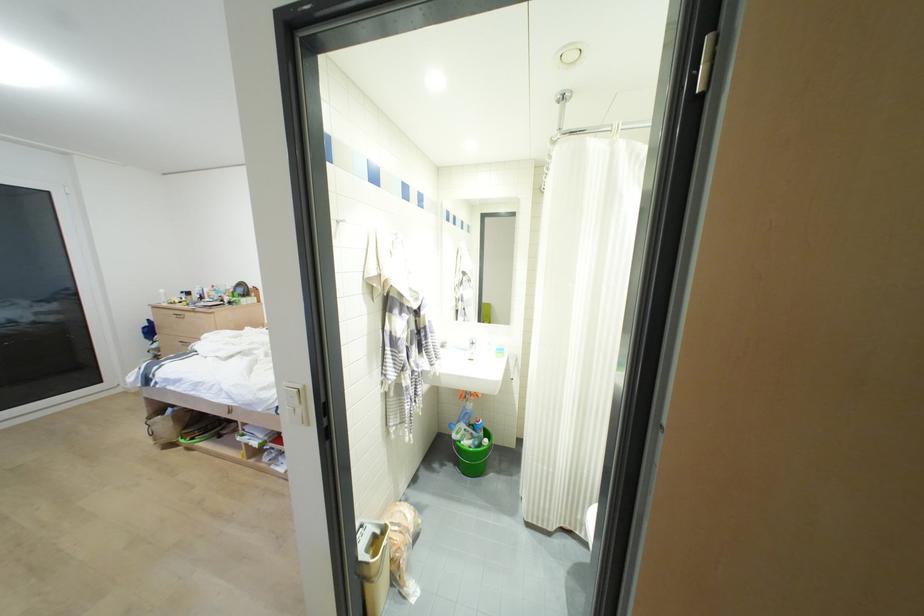
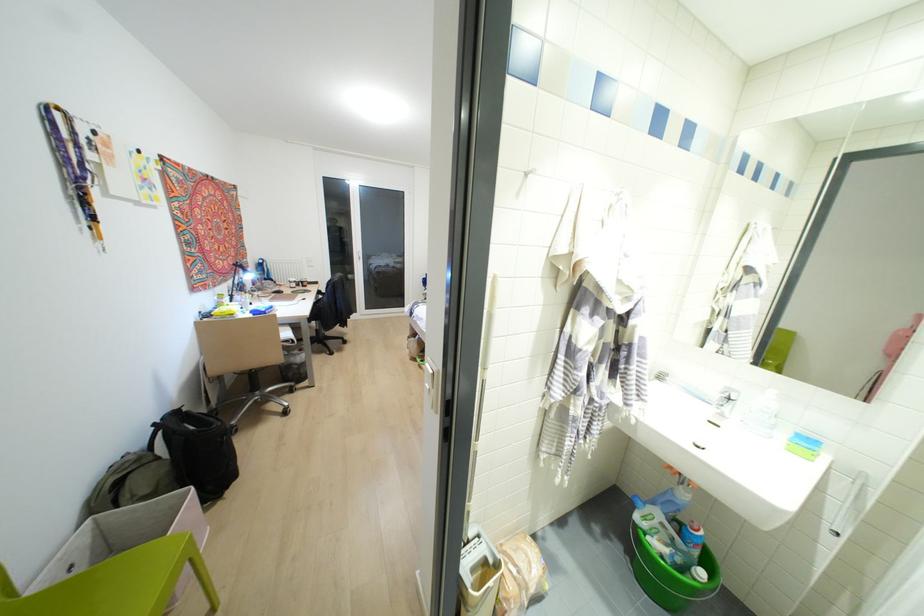
In the second image, find the point that corresponds to point (471, 353) in the first image.

(721, 415)